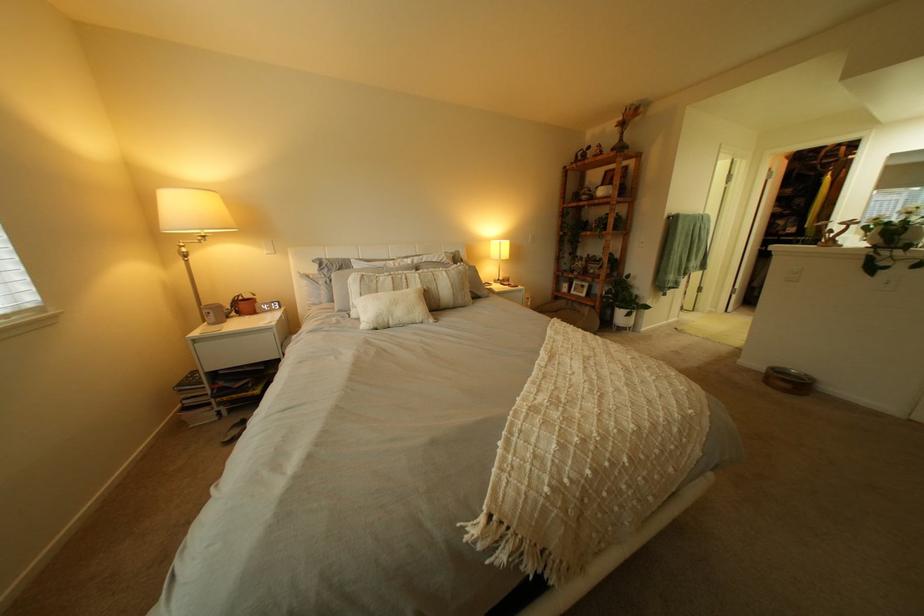
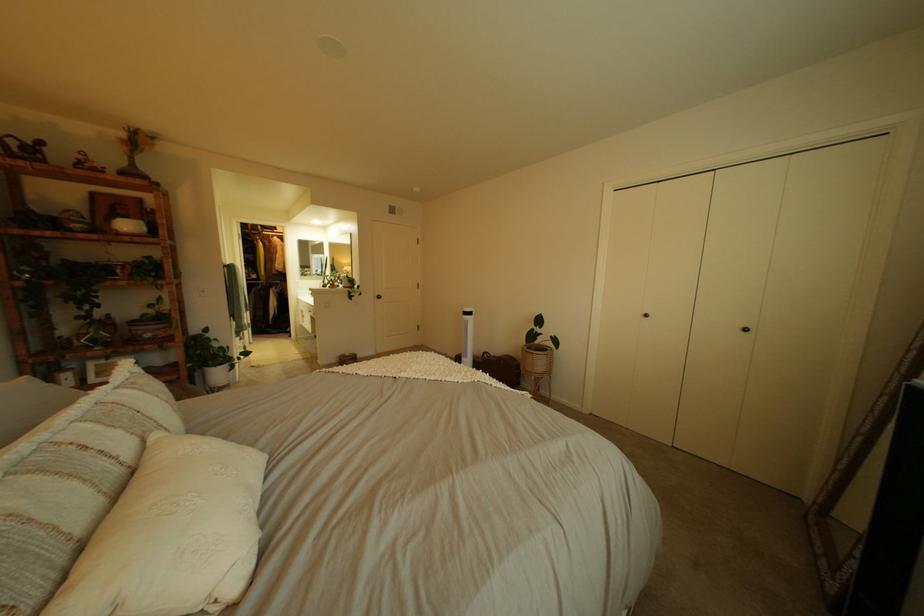
The point at (611, 257) is marked in the first image. Where is the corresponding point in the second image?

(161, 315)